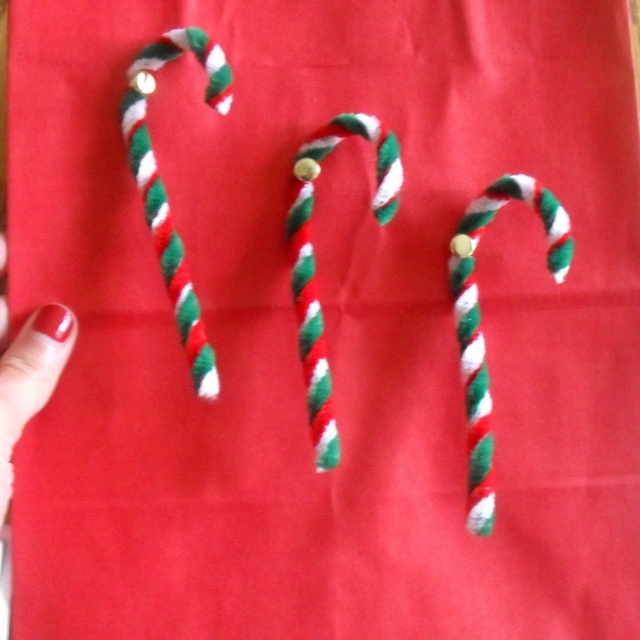
Question: From the image, what is the correct spatial relationship of twisted fabric candy cane at right in relation to twisted woolen candy cane at left?

Choices:
 (A) above
 (B) below

Answer: (B)

Question: Where is twisted fabric candy cane at right located in relation to twisted matte candy cane at center in the image?

Choices:
 (A) right
 (B) left

Answer: (A)

Question: Is twisted fabric candy cane at right above twisted woolen candy cane at left?

Choices:
 (A) no
 (B) yes

Answer: (A)

Question: Which of these objects is positioned closest to the twisted matte candy cane at center?

Choices:
 (A) twisted woolen candy cane at left
 (B) twisted fabric candy cane at right

Answer: (A)

Question: Which object appears farthest from the camera in this image?

Choices:
 (A) twisted woolen candy cane at left
 (B) twisted fabric candy cane at right

Answer: (A)

Question: Which object appears farthest from the camera in this image?

Choices:
 (A) twisted matte candy cane at center
 (B) twisted woolen candy cane at left
 (C) twisted fabric candy cane at right

Answer: (A)